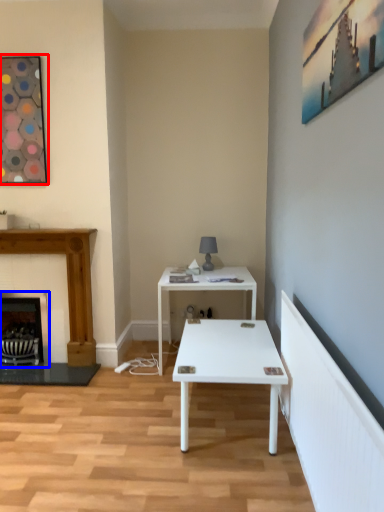
Question: Which of the following is the closest to the observer, picture frame (highlighted by a red box) or fireplace (highlighted by a blue box)?

Choices:
 (A) picture frame
 (B) fireplace

Answer: (A)